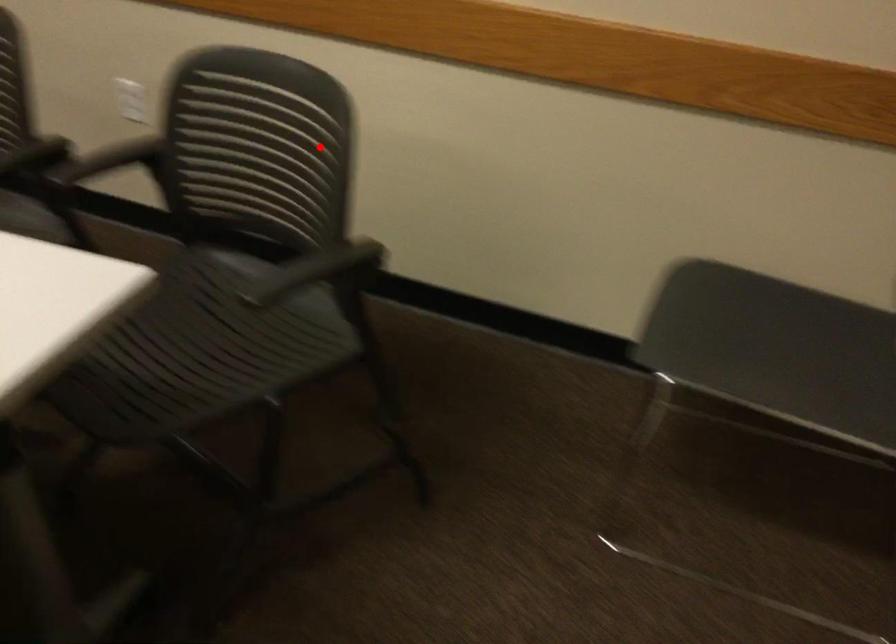
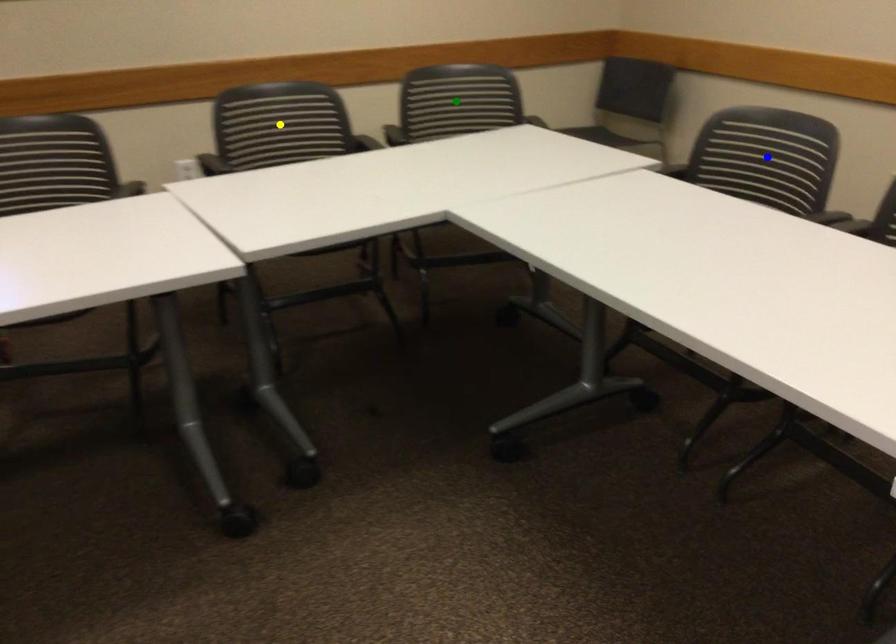
Question: I am providing you with two images of the same scene from different viewpoints. A red point is marked on the first image. You are given multiple points on the second image. Which spot in image 2 lines up with the point in image 1?

Choices:
 (A) blue point
 (B) yellow point
 (C) green point

Answer: (C)